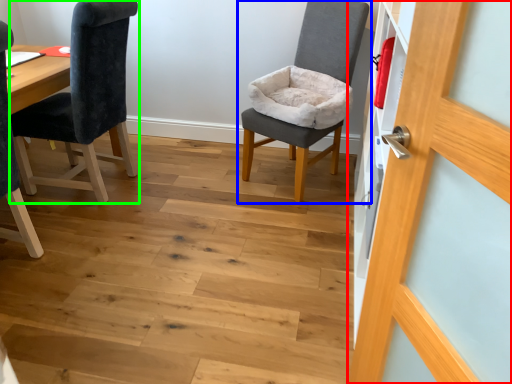
Question: Which is farther away from door (highlighted by a red box)? chair (highlighted by a blue box) or chair (highlighted by a green box)?

Choices:
 (A) chair
 (B) chair

Answer: (B)